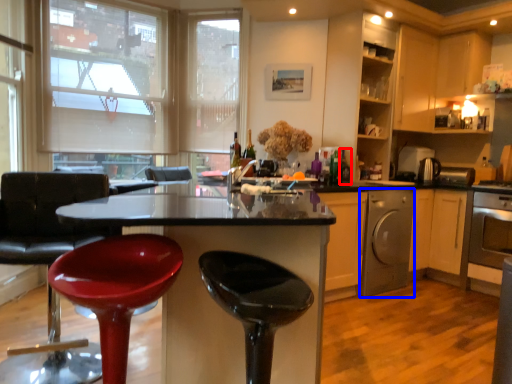
Question: Which object appears farthest to the camera in this image, bottle (highlighted by a red box) or kitchen appliance (highlighted by a blue box)?

Choices:
 (A) bottle
 (B) kitchen appliance

Answer: (B)